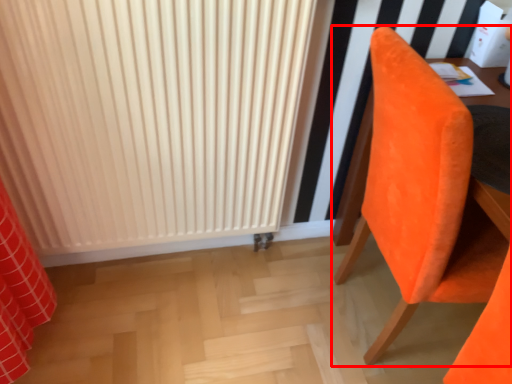
Question: In this image, where is chair (annotated by the red box) located relative to radiator?

Choices:
 (A) left
 (B) right

Answer: (B)